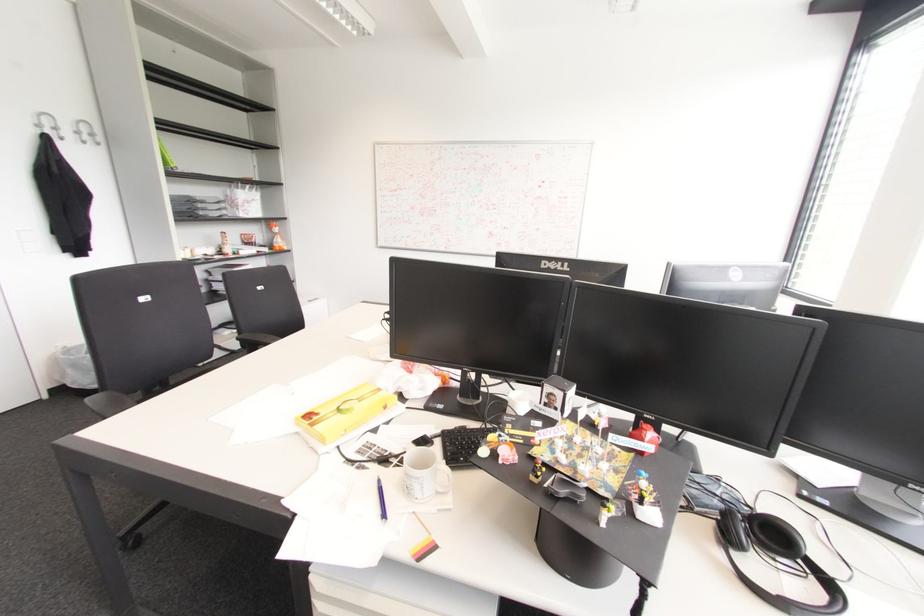
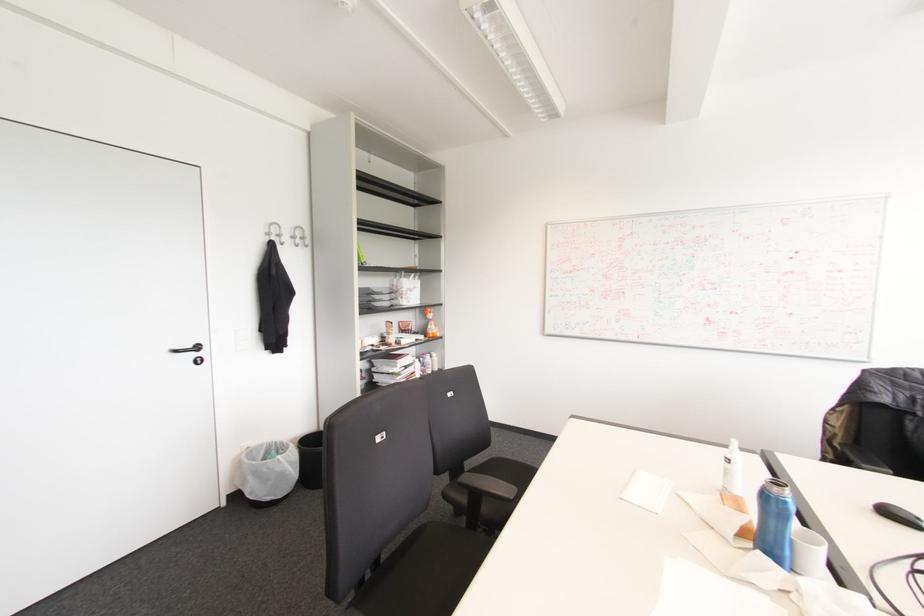
Locate, in the second image, the point that corresponds to point 68,370 in the first image.

(249, 477)